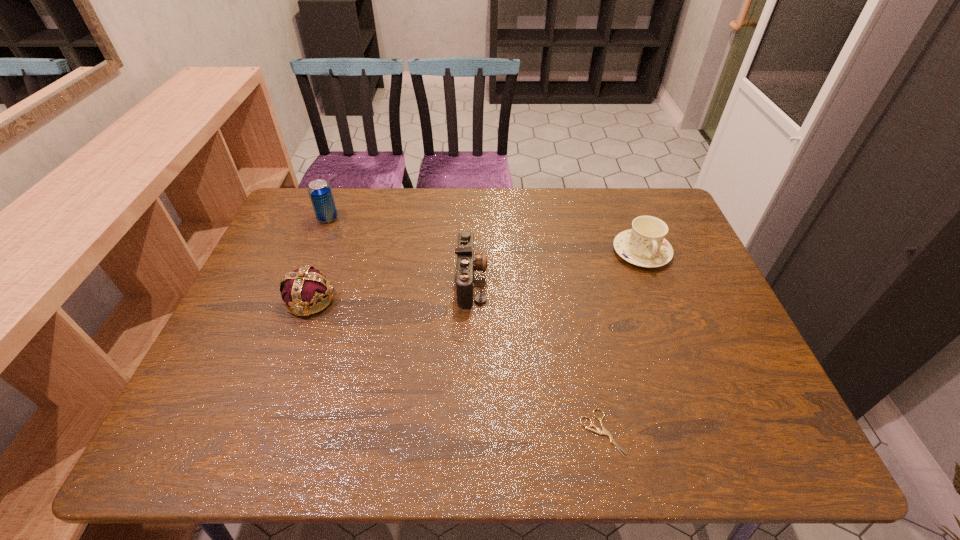
This screenshot has height=540, width=960. I want to click on free region at the left edge of the desktop, so click(x=281, y=262).

Locate an element on the screen. free space at the right edge is located at coordinates (718, 324).

Locate an element on the screen. vacant space at the far right corner of the desktop is located at coordinates (668, 221).

I want to click on vacant area that lies between the crown and the nearest object, so click(x=456, y=366).

At what (x,y) coordinates should I click in order to perform the action: click on empty location between the third object from left to right and the farthest object. Please return your answer as a coordinate pair (x, y). Looking at the image, I should click on (399, 249).

Identify the location of free space between the shears and the crown. (456, 366).

Image resolution: width=960 pixels, height=540 pixels. Identify the location of free space between the crown and the shortest object. (456, 366).

Where is `free spot between the crown and the chinaware`? Image resolution: width=960 pixels, height=540 pixels. free spot between the crown and the chinaware is located at coordinates (476, 275).

Identify the location of free space between the chinaware and the farthest object. (485, 235).

Locate an element on the screen. Image resolution: width=960 pixels, height=540 pixels. free point between the fourth object from left to right and the crown is located at coordinates (456, 366).